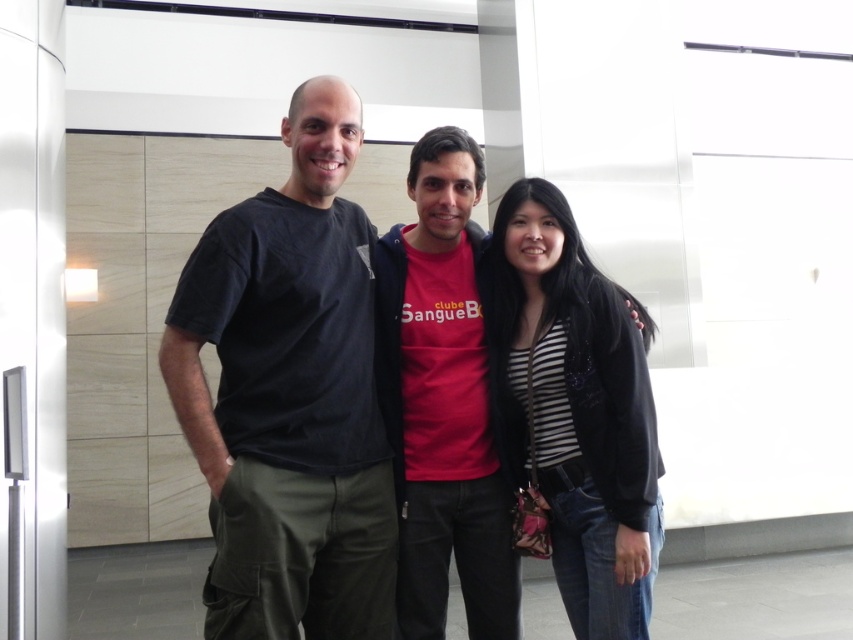
Can you confirm if striped fabric jacket at center is positioned above matte red t-shirt at center?

No, striped fabric jacket at center is not above matte red t-shirt at center.

Between striped fabric jacket at center and matte red t-shirt at center, which one is positioned higher?

matte red t-shirt at center

Does point (582, 557) come closer to viewer compared to point (427, 256)?

Yes.

What are the coordinates of `striped fabric jacket at center` in the screenshot? It's located at (576, 410).

Is dark gray cotton t-shirt at center bigger than striped fabric jacket at center?

Yes.

Is dark gray cotton t-shirt at center taller than striped fabric jacket at center?

Correct, dark gray cotton t-shirt at center is much taller as striped fabric jacket at center.

Who is more distant from viewer, [357,374] or [624,573]?

Positioned behind is point [357,374].

This screenshot has height=640, width=853. I want to click on dark gray cotton t-shirt at center, so click(289, 396).

Who is higher up, dark gray cotton t-shirt at center or matte red t-shirt at center?

dark gray cotton t-shirt at center is above.

Is dark gray cotton t-shirt at center positioned in front of matte red t-shirt at center?

Yes.

You are a GUI agent. You are given a task and a screenshot of the screen. Output one action in this format:
    pyautogui.click(x=<x>, y=<y>)
    Task: Click on the dark gray cotton t-shirt at center
    The width and height of the screenshot is (853, 640).
    Given the screenshot: What is the action you would take?
    pyautogui.click(x=289, y=396)